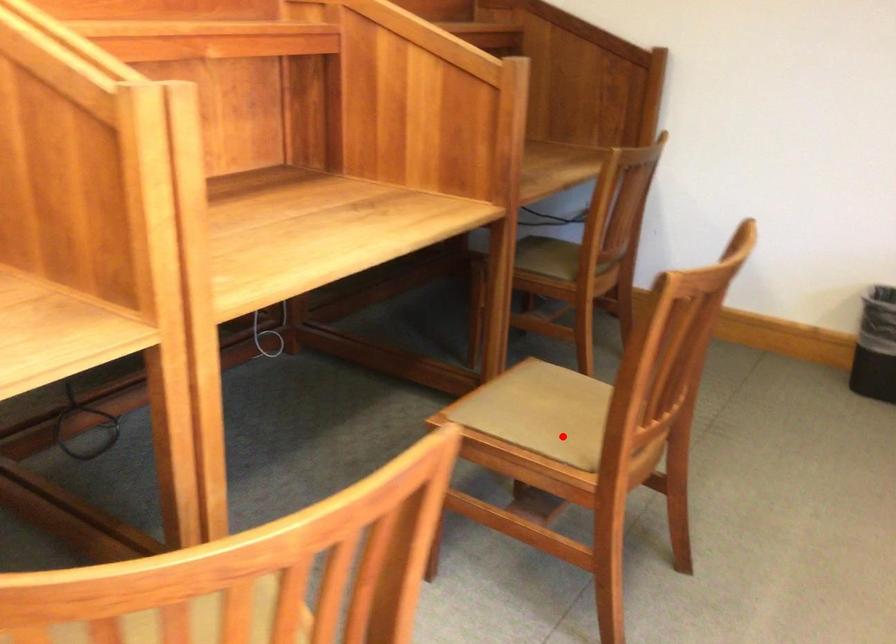
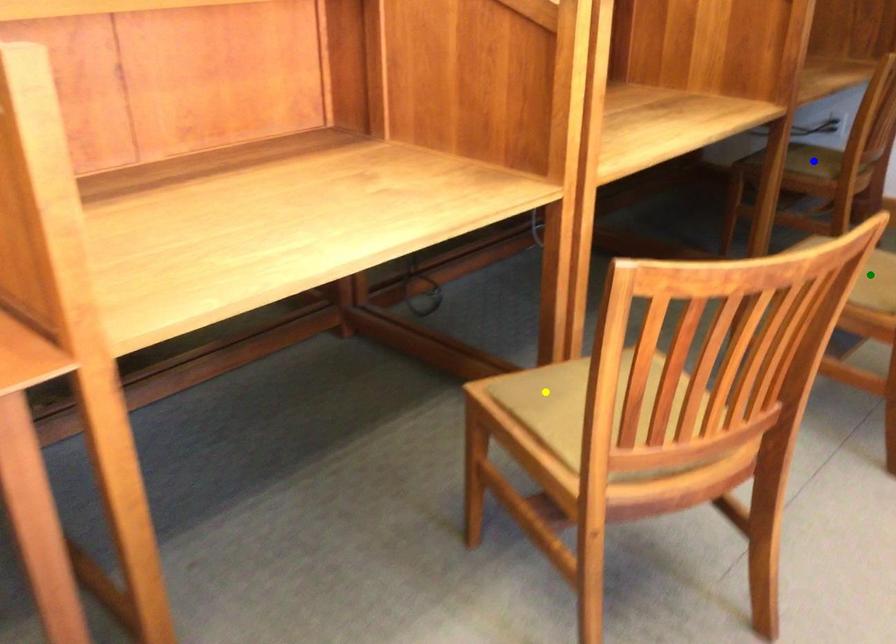
Question: I am providing you with two images of the same scene from different viewpoints. A red point is marked on the first image. You are given multiple points on the second image. Which point in image 2 is actually the same real-world point as the red point in image 1?

Choices:
 (A) blue point
 (B) yellow point
 (C) green point

Answer: (C)